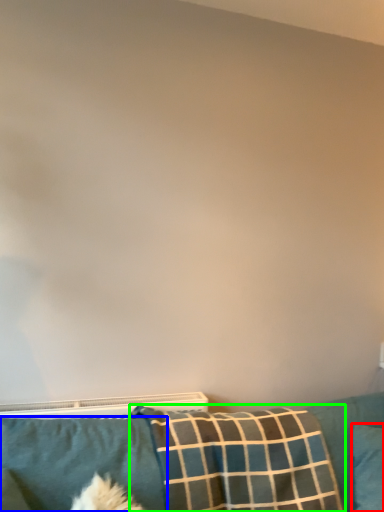
Question: Which object is positioned closest to pillow (highlighted by a red box)? Select from pillow (highlighted by a blue box) and pillow (highlighted by a green box).

Choices:
 (A) pillow
 (B) pillow

Answer: (B)